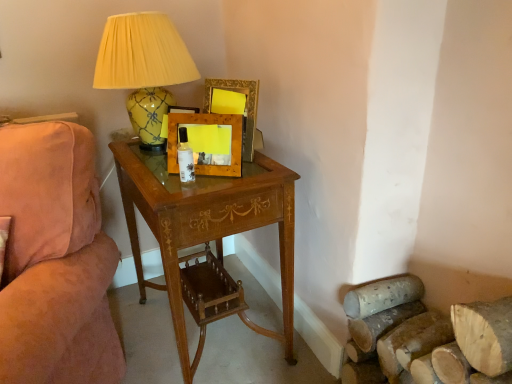
Identify the location of free spot in front of wooden picture frame at center, marked as the first picture frame in a front-to-back arrangement. (204, 186).